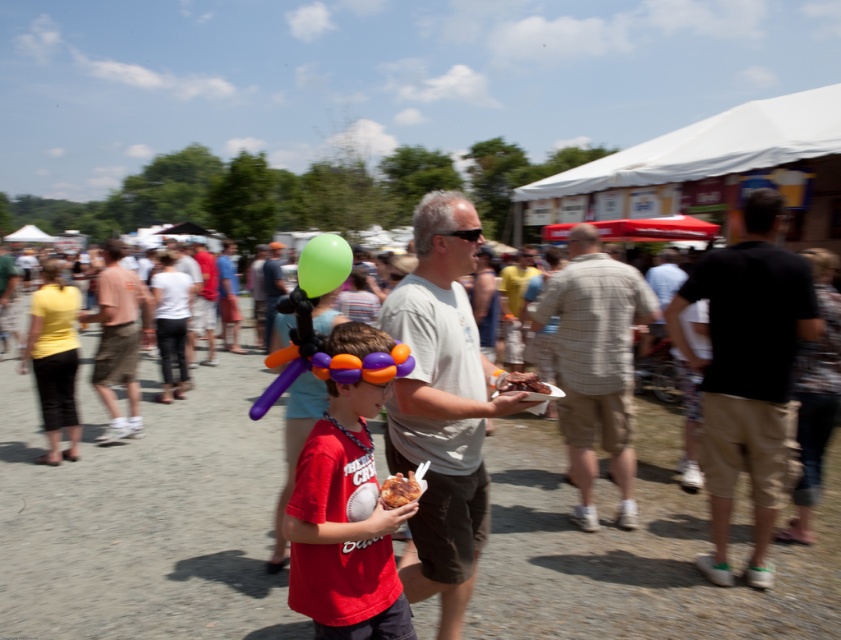
You are at the fair and want to find the plaid shirt at center. Which coordinates should you look at?

You should look at coordinates point [595,364] to find the plaid shirt at center.

You are a photographer standing at the center of the scene. You want to take a photo that includes both the plaid shirt at center and the matte khaki shorts at left. If your camera has a maximum range of 3 meters, will you be able to capture both in the same frame?

The plaid shirt at center is 3.75 meters from matte khaki shorts at left, which exceeds the camera range of 3 meters. Therefore, you cannot capture both in the same frame.

You are a photographer at the fair and want to capture both the gray cotton shirt at center and the black cotton shirt at right in a single photo. Which shirt should you focus on first to ensure both are in the frame?

You should focus on the gray cotton shirt at center first because it is in front of the black cotton shirt at right, so positioning the camera to include the foreground subject ensures the background one is also captured.